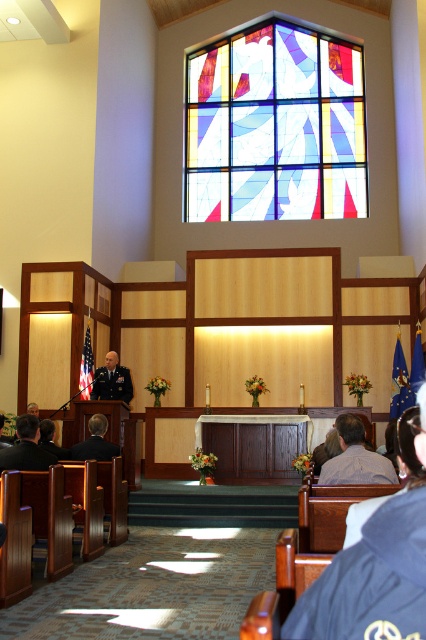
How distant is light brown leather jacket at lower center from black uniform at center?

light brown leather jacket at lower center and black uniform at center are 13.53 feet apart from each other.

Can you confirm if light brown leather jacket at lower center is positioned below black uniform at center?

No, light brown leather jacket at lower center is not below black uniform at center.

Identify the location of light brown leather jacket at lower center. (354, 458).

Where is `light brown leather jacket at lower center`? The image size is (426, 640). light brown leather jacket at lower center is located at coordinates (354, 458).

What do you see at coordinates (275, 125) in the screenshot? The width and height of the screenshot is (426, 640). I see `stained glass window at upper center` at bounding box center [275, 125].

Between stained glass window at upper center and blue denim jacket at lower right, which one appears on the left side from the viewer's perspective?

Positioned to the left is blue denim jacket at lower right.

Is point (362, 97) positioned after point (425, 497)?

That is True.

Locate an element on the screen. Image resolution: width=426 pixels, height=640 pixels. stained glass window at upper center is located at coordinates (275, 125).

Consider the image. Who is shorter, stained glass window at upper center or light brown leather jacket at lower center?

With less height is stained glass window at upper center.

Is stained glass window at upper center closer to camera compared to light brown leather jacket at lower center?

No, stained glass window at upper center is behind light brown leather jacket at lower center.

Locate an element on the screen. The width and height of the screenshot is (426, 640). stained glass window at upper center is located at coordinates point(275,125).